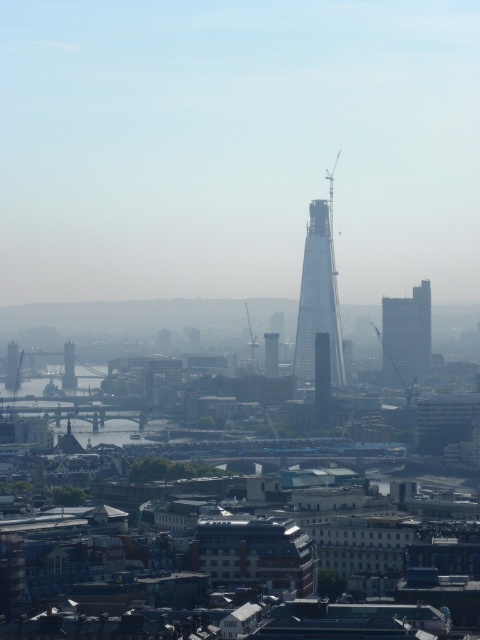
You are a tourist standing on the riverbank looking at the city skyline. You notice the matte gray building at right and the glass skyscraper at center. Which of these two buildings is closer to you?

The matte gray building at right is closer to you because the glass skyscraper at center is positioned behind it.

Based on the cityscape image provided, which object is situated exactly at the coordinates point [407,336]?

The matte gray building at right is situated exactly at the coordinates point [407,336].